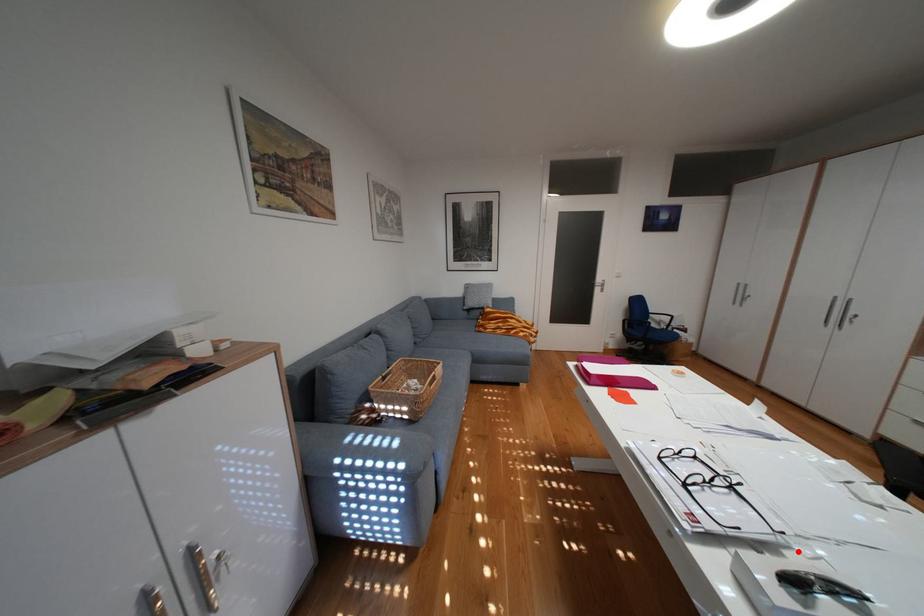
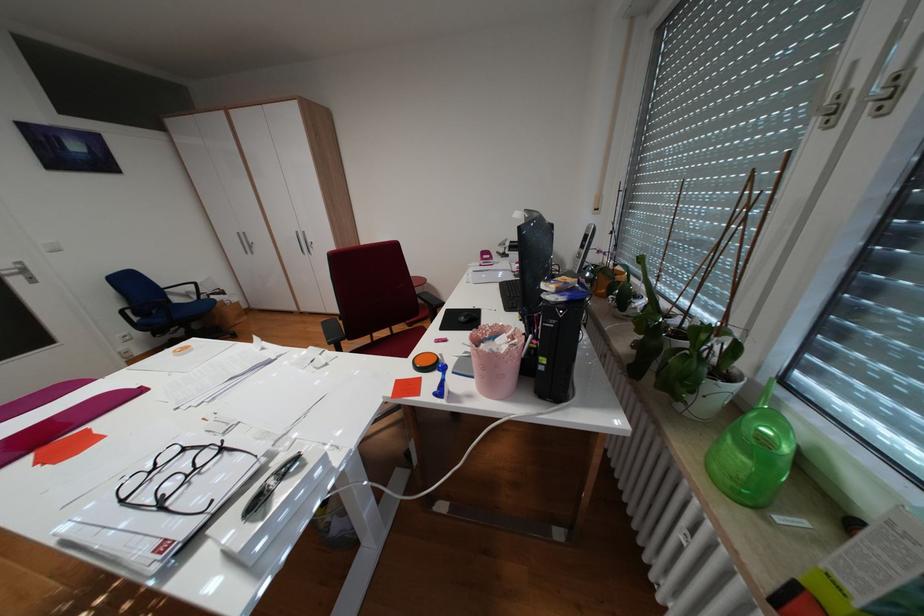
Locate, in the second image, the point that corresponds to the highlighted location in the first image.

(285, 464)